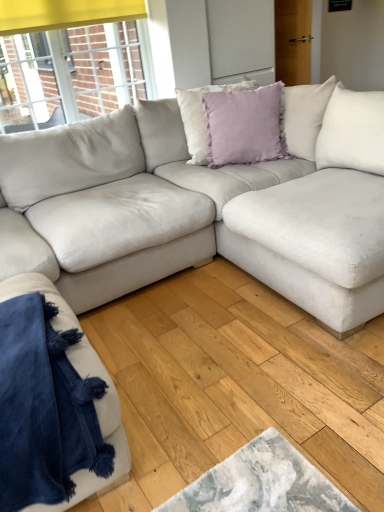
Question: Considering their positions, is lavender velvet pillow at upper center, which is the 1th pillow from front to back, located in front of or behind lavender velvet pillow at center, the first pillow positioned from the back?

Choices:
 (A) front
 (B) behind

Answer: (A)

Question: Is point (254, 132) closer or farther from the camera than point (196, 160)?

Choices:
 (A) closer
 (B) farther

Answer: (A)

Question: Which is nearer to the lavender velvet pillow at center, the first pillow positioned from the back?

Choices:
 (A) lavender velvet pillow at upper center, which is the 1th pillow from front to back
 (B) velvet blue blanket at lower left

Answer: (A)

Question: Considering the real-world distances, which object is closest to the velvet blue blanket at lower left?

Choices:
 (A) lavender velvet pillow at upper center, which is the 1th pillow from front to back
 (B) lavender velvet pillow at center, the first pillow positioned from the back

Answer: (A)